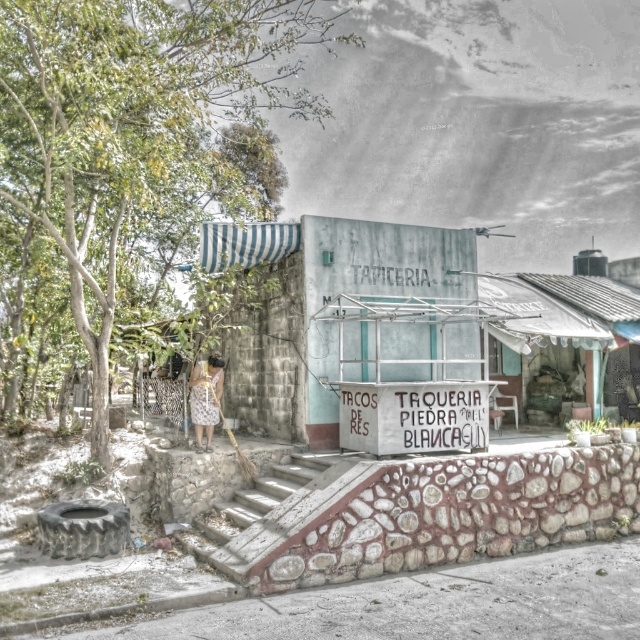
Question: Which of the following is the closest to the observer?

Choices:
 (A) (202, 376)
 (B) (248, 524)

Answer: (B)

Question: Can you confirm if concrete stairs at center is thinner than patterned fabric dress at center?

Choices:
 (A) yes
 (B) no

Answer: (B)

Question: Which point is closer to the camera taking this photo?

Choices:
 (A) (193, 372)
 (B) (260, 513)

Answer: (B)

Question: Does concrete stairs at center appear over patterned fabric dress at center?

Choices:
 (A) no
 (B) yes

Answer: (A)

Question: Is concrete stairs at center thinner than patterned fabric dress at center?

Choices:
 (A) yes
 (B) no

Answer: (B)